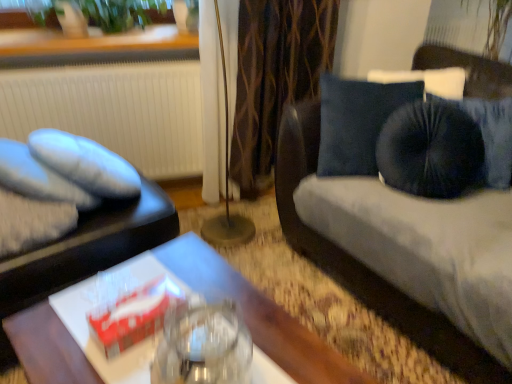
You are a GUI agent. You are given a task and a screenshot of the screen. Output one action in this format:
    pyautogui.click(x=<x>, y=<y>)
    Task: Click on the vacant area on top of wooden table at center (from a real-world perspective)
    The height and width of the screenshot is (384, 512).
    Given the screenshot: What is the action you would take?
    pyautogui.click(x=160, y=328)